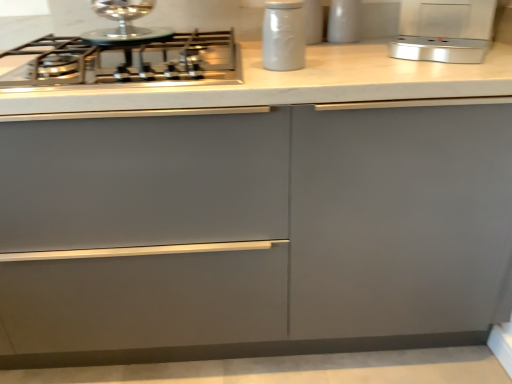
Question: Is satin silver toaster at upper right, placed as the 1th kitchen appliance when sorted from right to left, shorter than white matte jar at upper center?

Choices:
 (A) yes
 (B) no

Answer: (A)

Question: Does satin silver toaster at upper right, placed as the 1th kitchen appliance when sorted from right to left, come behind white matte jar at upper center?

Choices:
 (A) no
 (B) yes

Answer: (A)

Question: Can white matte jar at upper center be found inside satin silver toaster at upper right, the 3th kitchen appliance in the left-to-right sequence?

Choices:
 (A) yes
 (B) no

Answer: (B)

Question: Is satin silver toaster at upper right, placed as the 1th kitchen appliance when sorted from right to left, positioned before white matte jar at upper center?

Choices:
 (A) yes
 (B) no

Answer: (A)

Question: From a real-world perspective, is satin silver toaster at upper right, the 3th kitchen appliance in the left-to-right sequence, located beneath white matte jar at upper center?

Choices:
 (A) yes
 (B) no

Answer: (A)

Question: In the image, is matte gray cabinet at center positioned in front of or behind satin silver toaster at upper right, the 3th kitchen appliance in the left-to-right sequence?

Choices:
 (A) behind
 (B) front

Answer: (B)

Question: From a real-world perspective, is matte gray cabinet at center physically located above or below satin silver toaster at upper right, placed as the 1th kitchen appliance when sorted from right to left?

Choices:
 (A) below
 (B) above

Answer: (A)

Question: Choose the correct answer: Is matte gray cabinet at center inside satin silver toaster at upper right, the 3th kitchen appliance in the left-to-right sequence, or outside it?

Choices:
 (A) outside
 (B) inside

Answer: (A)

Question: Looking at their shapes, would you say matte gray cabinet at center is wider or thinner than satin silver toaster at upper right, the 3th kitchen appliance in the left-to-right sequence?

Choices:
 (A) wide
 (B) thin

Answer: (A)

Question: Do you think white matte jar at upper center, which is counted as the third kitchen appliance, starting from the right, is within white glossy jar at upper center, the 2th kitchen appliance from the right, or outside of it?

Choices:
 (A) outside
 (B) inside

Answer: (A)

Question: Based on their sizes in the image, would you say white matte jar at upper center, marked as the 1th kitchen appliance in a left-to-right arrangement, is bigger or smaller than white glossy jar at upper center, the 2th kitchen appliance from the right?

Choices:
 (A) small
 (B) big

Answer: (B)

Question: Is white matte jar at upper center, marked as the 1th kitchen appliance in a left-to-right arrangement, to the left or to the right of white glossy jar at upper center, the 2th kitchen appliance from the right, in the image?

Choices:
 (A) right
 (B) left

Answer: (B)

Question: From the image's perspective, is white matte jar at upper center, which is counted as the third kitchen appliance, starting from the right, above or below white glossy jar at upper center, the 2th kitchen appliance from the right?

Choices:
 (A) below
 (B) above

Answer: (A)

Question: Considering the positions of white glossy jar at upper center, the 2th kitchen appliance from the right, and satin steel gas stove at upper left in the image, is white glossy jar at upper center, the 2th kitchen appliance from the right, bigger or smaller than satin steel gas stove at upper left?

Choices:
 (A) small
 (B) big

Answer: (A)

Question: In the image, is white glossy jar at upper center, the 2th kitchen appliance from the right, on the left side or the right side of satin steel gas stove at upper left?

Choices:
 (A) right
 (B) left

Answer: (A)